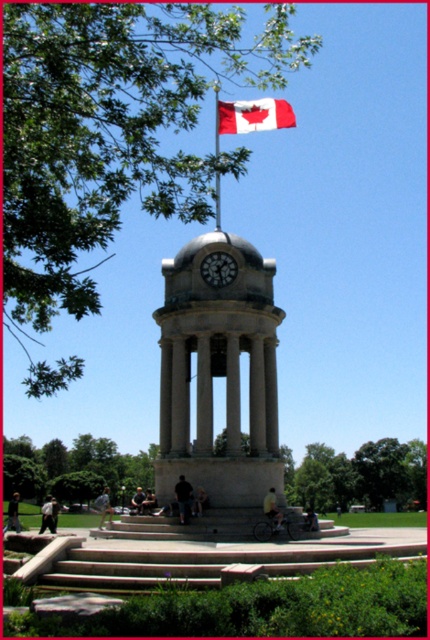
You are standing at point (215, 124) and want to walk towards the clock tower. Is the point (235, 420) located between you and the clock tower?

Yes, point (235, 420) is located between you and the clock tower because it is in front of point (215, 124), which is your current position.

You are planning to place a decorative item on a shelf that can only hold items up to the width of the matte gray clock at center. You have the white cotton flag at upper center. Will it fit?

The white cotton flag at upper center has a larger width than the matte gray clock at center, so it will not fit on the shelf.

Based on the provided scene description, where is the white marble clock tower at center located in terms of its 2D coordinates?

The white marble clock tower at center is located at the 2D coordinates of point (218, 372).